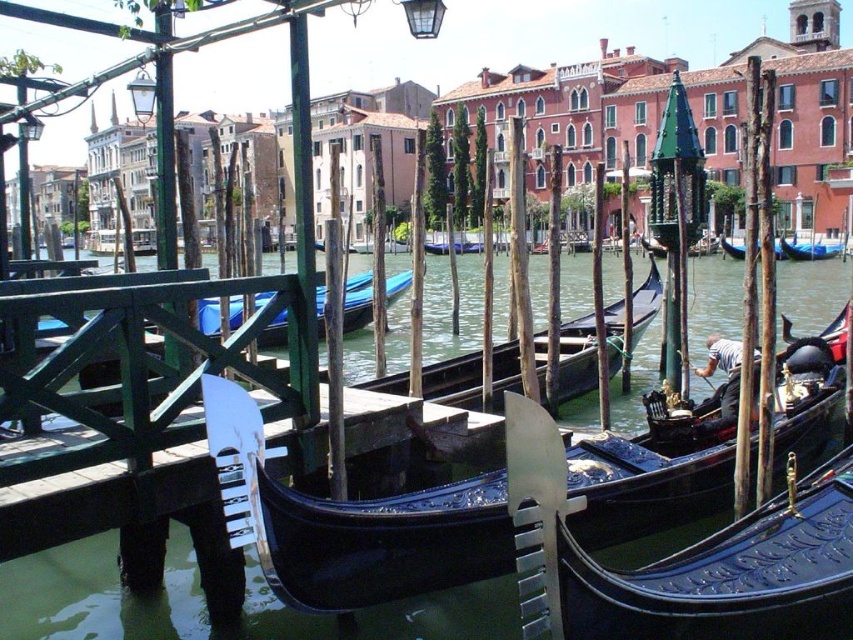
Question: Which of the following is the farthest from the observer?

Choices:
 (A) blue glossy gondola at center
 (B) green glossy gondola at right
 (C) black polished gondola at center
 (D) blue glossy boat at center

Answer: (B)

Question: Which of the following is the farthest from the observer?

Choices:
 (A) (469, 579)
 (B) (432, 253)

Answer: (B)

Question: Can you confirm if black polished wood gondola at center is positioned to the left of blue glossy gondola at center?

Choices:
 (A) no
 (B) yes

Answer: (A)

Question: Does black polished wood gondola at center come behind black polished gondola at center?

Choices:
 (A) no
 (B) yes

Answer: (A)

Question: Which of the following is the closest to the observer?

Choices:
 (A) (817, 241)
 (B) (469, 241)

Answer: (A)

Question: Can you confirm if blue glossy gondola at center is wider than green glossy gondola at right?

Choices:
 (A) no
 (B) yes

Answer: (B)